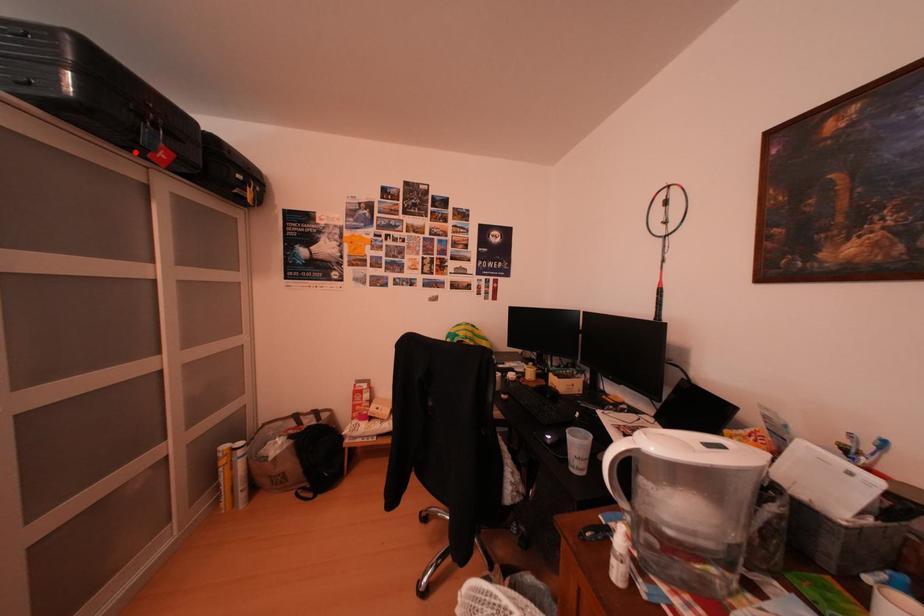
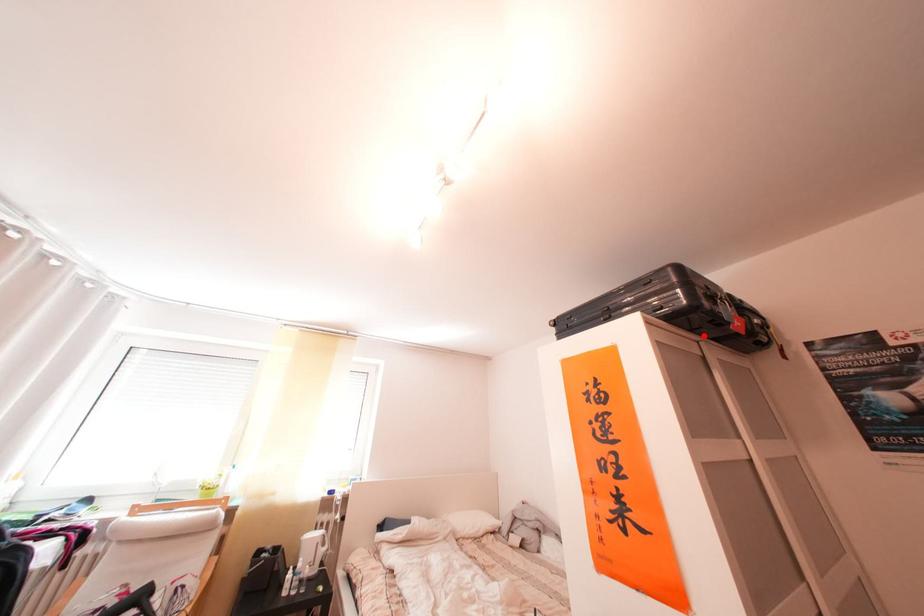
I am providing you with two images of the same scene from different viewpoints. A red point is marked on the first image and another point is marked on the second image. Is the red point in image1 aligned with the point shown in image2?

Yes